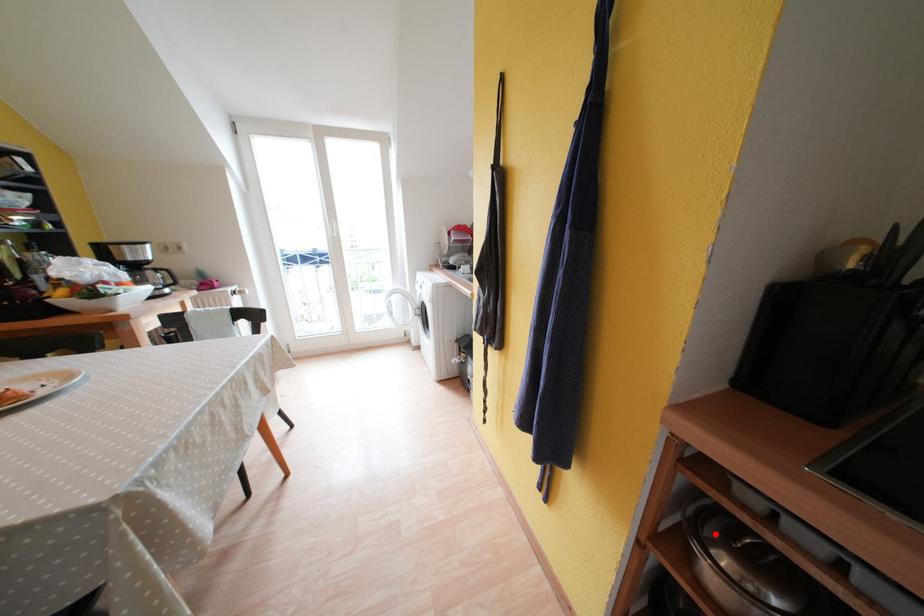
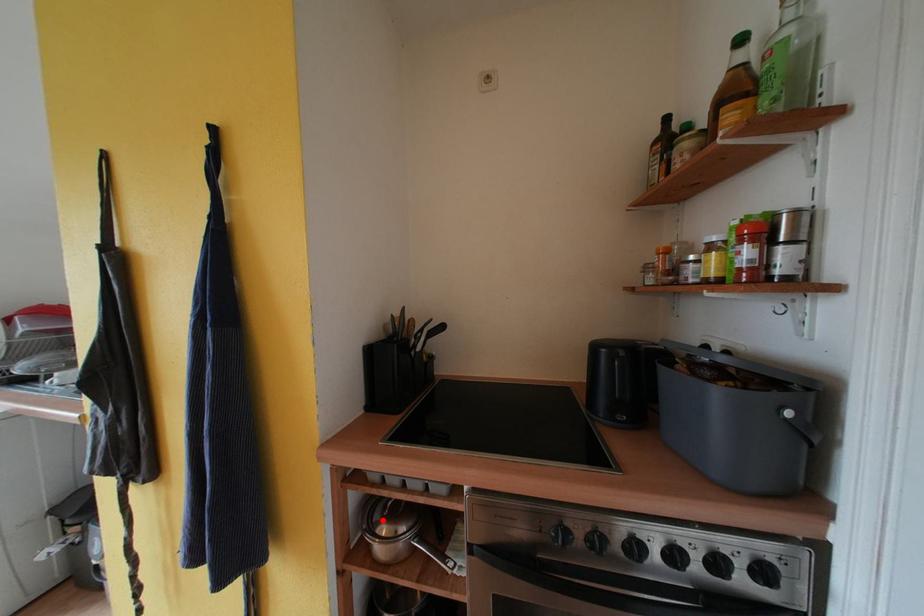
I am providing you with two images of the same scene from different viewpoints. A red point is marked on the first image and another point is marked on the second image. Do the highlighted points in image1 and image2 indicate the same real-world spot?

Yes